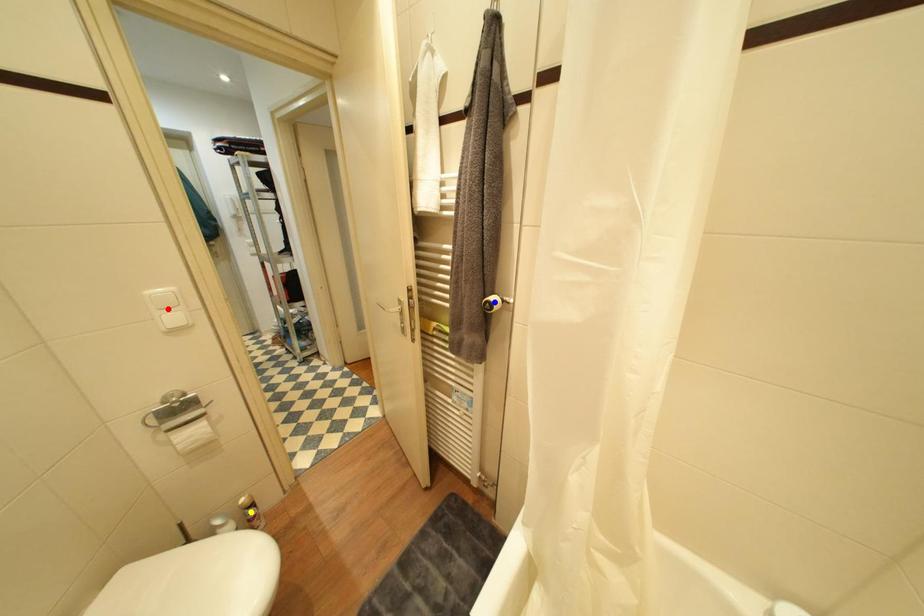
Order these from farthest to nearest:
blue point
red point
yellow point

yellow point, red point, blue point